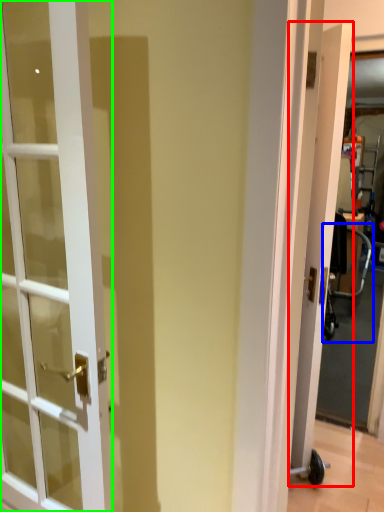
Question: Based on their relative distances, which object is nearer to door (highlighted by a red box)? Choose from baby carriage (highlighted by a blue box) and door (highlighted by a green box).

Choices:
 (A) baby carriage
 (B) door

Answer: (B)